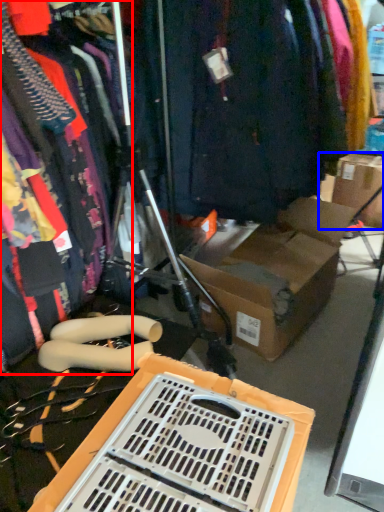
Question: Which point is closer to the camera, clothing (highlighted by a red box) or cardboard box (highlighted by a blue box)?

Choices:
 (A) clothing
 (B) cardboard box

Answer: (A)